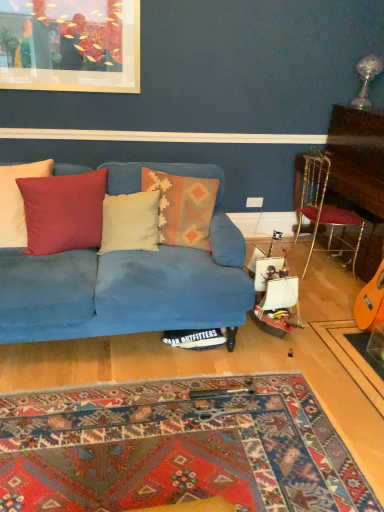
Question: Does velvet blue couch at center appear on the left side of matte red cushion at left, positioned as the 4th pillow in right-to-left order?

Choices:
 (A) yes
 (B) no

Answer: (B)

Question: Is velvet blue couch at center not close to matte red cushion at left, positioned as the 4th pillow in right-to-left order?

Choices:
 (A) no
 (B) yes

Answer: (A)

Question: Can you confirm if velvet blue couch at center is taller than matte red cushion at left, positioned as the 4th pillow in right-to-left order?

Choices:
 (A) no
 (B) yes

Answer: (B)

Question: From a real-world perspective, is velvet blue couch at center located higher than matte red cushion at left, positioned as the 4th pillow in right-to-left order?

Choices:
 (A) yes
 (B) no

Answer: (B)

Question: Can matte red cushion at left, positioned as the 4th pillow in right-to-left order, be found inside velvet blue couch at center?

Choices:
 (A) yes
 (B) no

Answer: (A)

Question: Can you confirm if velvet blue couch at center is positioned to the right of matte red cushion at left, positioned as the 4th pillow in right-to-left order?

Choices:
 (A) yes
 (B) no

Answer: (A)

Question: Is white plastic power outlet at upper right thinner than gold metallic chair at right?

Choices:
 (A) yes
 (B) no

Answer: (A)

Question: Is gold metallic chair at right completely or partially inside white plastic power outlet at upper right?

Choices:
 (A) yes
 (B) no

Answer: (B)

Question: Can we say white plastic power outlet at upper right lies outside gold metallic chair at right?

Choices:
 (A) no
 (B) yes

Answer: (B)

Question: From the image's perspective, is white plastic power outlet at upper right beneath gold metallic chair at right?

Choices:
 (A) yes
 (B) no

Answer: (B)

Question: Is white plastic power outlet at upper right positioned far away from gold metallic chair at right?

Choices:
 (A) no
 (B) yes

Answer: (A)

Question: From a real-world perspective, is white plastic power outlet at upper right on top of gold metallic chair at right?

Choices:
 (A) no
 (B) yes

Answer: (A)

Question: Does creamy soft pillow at center, arranged as the 2th pillow when viewed from the right, have a lesser width compared to textured woolen pillow at center, arranged as the 1th pillow when viewed from the right?

Choices:
 (A) yes
 (B) no

Answer: (A)